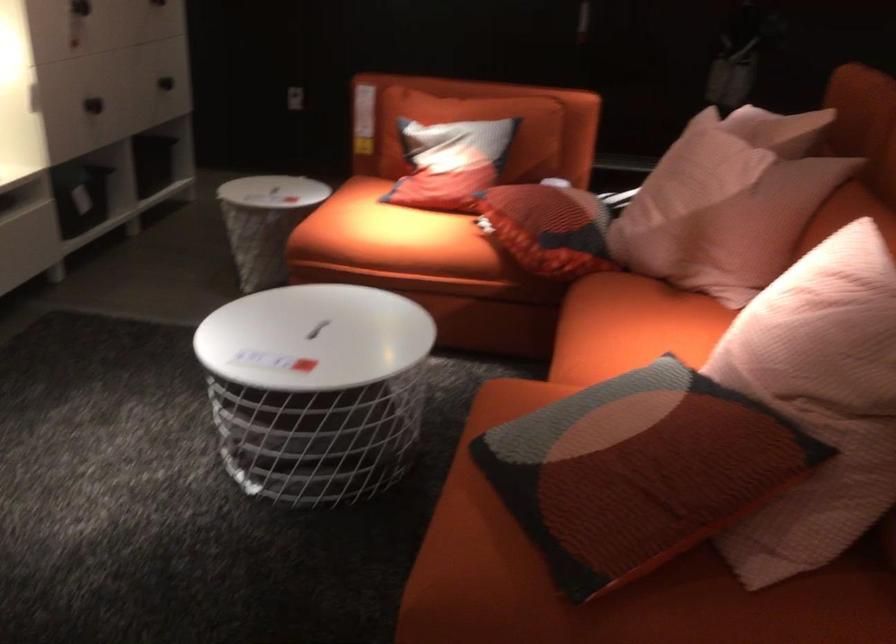
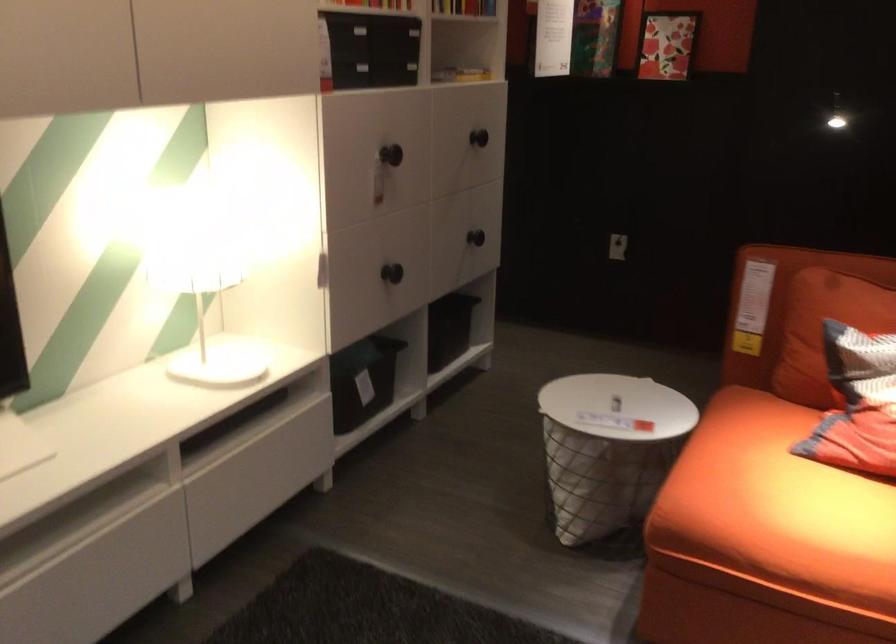
Which direction would the cameraman need to move to produce the second image?

The cameraman walked toward left, forward.